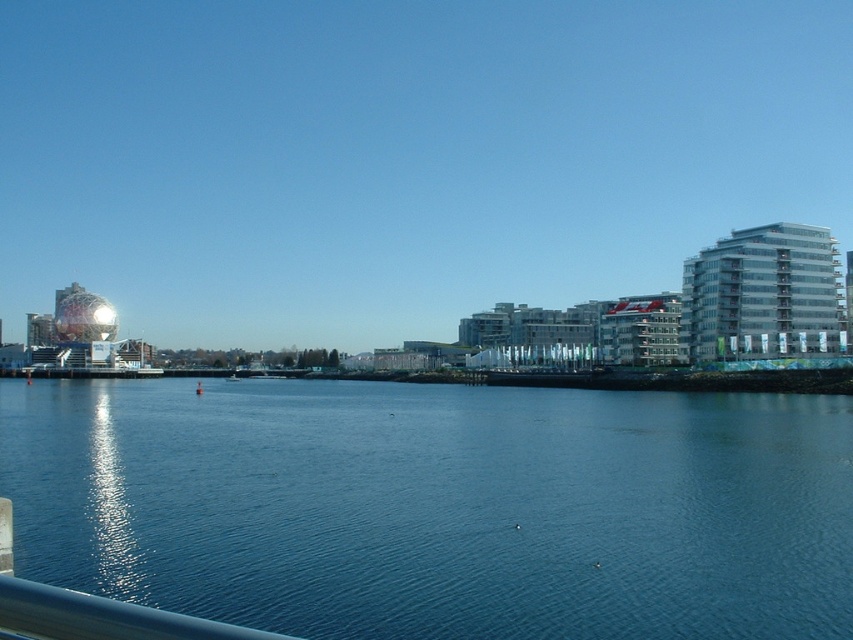
Which is above, blue water at center or metallic blue rail at lower left?

metallic blue rail at lower left is above.

Is blue water at center positioned behind metallic blue rail at lower left?

Yes.

Where is `blue water at center`? blue water at center is located at coordinates (438, 506).

Where is `blue water at center`? This screenshot has height=640, width=853. blue water at center is located at coordinates (438, 506).